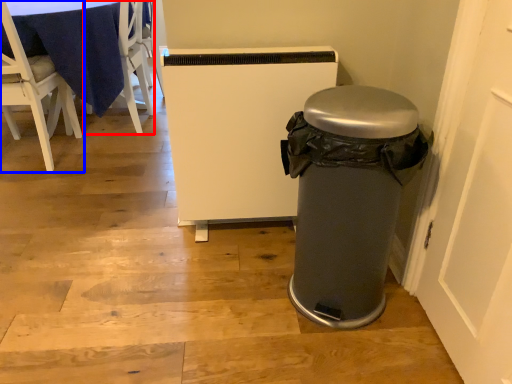
Question: Which object appears farthest to the camera in this image, chair (highlighted by a red box) or chair (highlighted by a blue box)?

Choices:
 (A) chair
 (B) chair

Answer: (A)